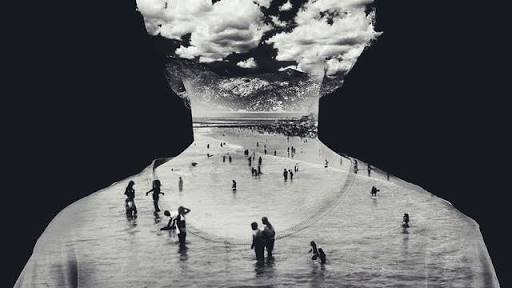
Locate an element on the screen. The image size is (512, 288). chest is located at coordinates (245, 265).